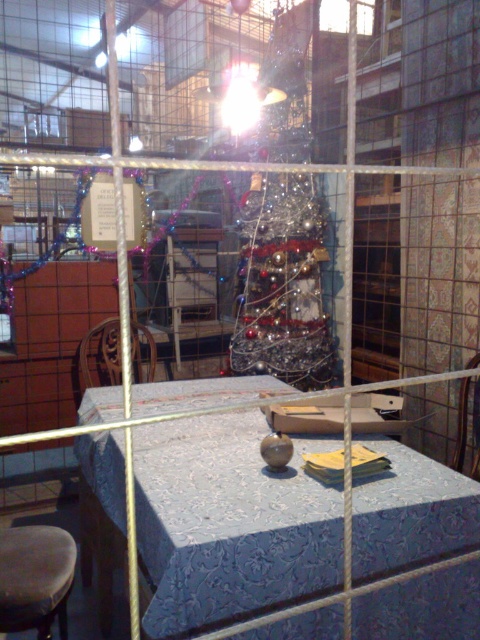
Question: Which is nearer to the brown leather stool at lower left?

Choices:
 (A) blue fabric table at center
 (B) shiny metallic christmas tree at center

Answer: (A)

Question: Estimate the real-world distances between objects in this image. Which object is farther from the brown leather stool at lower left?

Choices:
 (A) blue fabric table at center
 (B) shiny metallic christmas tree at center

Answer: (B)

Question: Is blue fabric table at center positioned before brown leather stool at lower left?

Choices:
 (A) no
 (B) yes

Answer: (B)

Question: Can you confirm if blue fabric table at center is wider than shiny metallic christmas tree at center?

Choices:
 (A) no
 (B) yes

Answer: (B)

Question: Based on their relative distances, which object is nearer to the blue fabric table at center?

Choices:
 (A) shiny metallic christmas tree at center
 (B) brown leather stool at lower left

Answer: (B)

Question: Is blue fabric table at center smaller than brown leather stool at lower left?

Choices:
 (A) yes
 (B) no

Answer: (B)